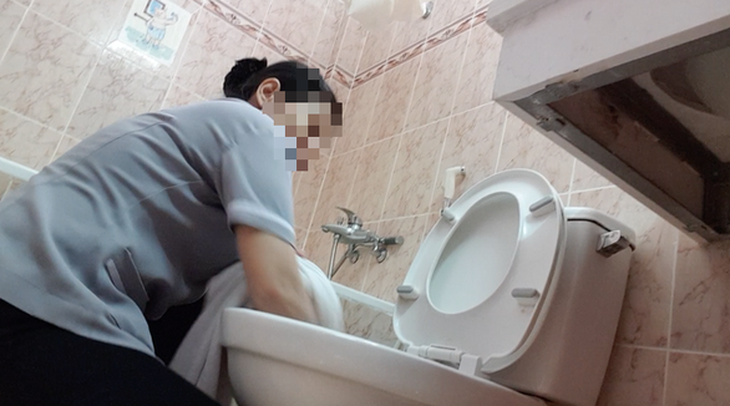
This screenshot has height=406, width=730. In order to click on toilet cover in this screenshot , I will do `click(466, 253)`.